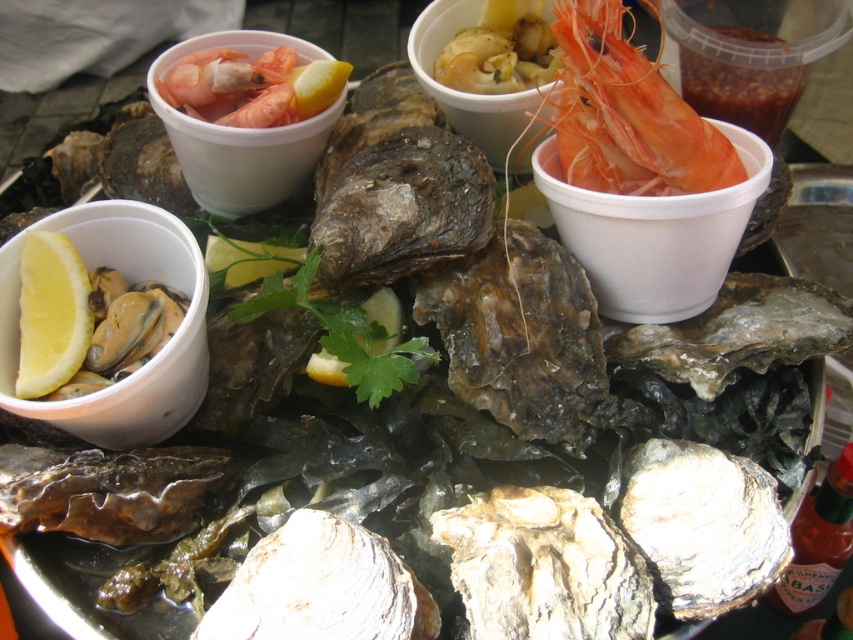
Can you confirm if yellow matte lemon at lower left is positioned to the right of shiny pink shrimp at upper left?

No, yellow matte lemon at lower left is not to the right of shiny pink shrimp at upper left.

Describe the element at coordinates (51, 314) in the screenshot. I see `yellow matte lemon at lower left` at that location.

This screenshot has width=853, height=640. What are the coordinates of `yellow matte lemon at lower left` in the screenshot? It's located at (51, 314).

Can you confirm if shiny orange shrimp at upper right is positioned to the right of shiny pink shrimp at upper left?

Yes, shiny orange shrimp at upper right is to the right of shiny pink shrimp at upper left.

Which is above, shiny orange shrimp at upper right or shiny pink shrimp at upper left?

Positioned higher is shiny pink shrimp at upper left.

Who is more distant from viewer, (683, 180) or (254, 84)?

The point (254, 84) is behind.

The height and width of the screenshot is (640, 853). In order to click on shiny orange shrimp at upper right in this screenshot , I will do `click(627, 115)`.

Is shiny orange shrimp at upper right to the right of yellow matte lemon at lower left from the viewer's perspective?

Indeed, shiny orange shrimp at upper right is positioned on the right side of yellow matte lemon at lower left.

Can you confirm if shiny orange shrimp at upper right is positioned to the left of yellow matte lemon at lower left?

In fact, shiny orange shrimp at upper right is to the right of yellow matte lemon at lower left.

Where is `shiny orange shrimp at upper right`? Image resolution: width=853 pixels, height=640 pixels. shiny orange shrimp at upper right is located at coordinates (627, 115).

Find the location of a particular element. The image size is (853, 640). shiny orange shrimp at upper right is located at coordinates (627, 115).